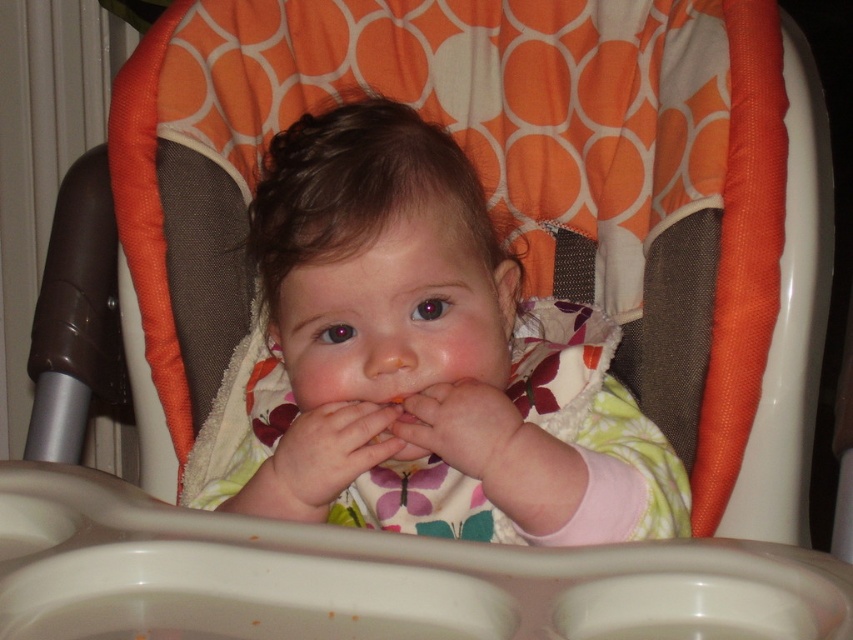
You are a caregiver observing the baby in the high chair. You notice the floral fabric baby at center and the smooth skin hand at center. Which object is wider?

The floral fabric baby at center is wider than the smooth skin hand at center.

You are a photographer trying to capture a closeup of the baby in the high chair. You notice two points marked in the image at coordinates point (316, 488) and point (471, 442). Which point should you focus on to ensure the baby is in focus?

Point (471, 442) should be focused on because it is in front of point (316, 488), making it closer to the camera and thus better for focusing on the baby.

You are a photographer trying to capture the baby in the high chair. You notice a point at coordinates [426,358] in the image. Can you determine what object this point is pointing to?

The point at coordinates [426,358] corresponds to the floral fabric baby at center.